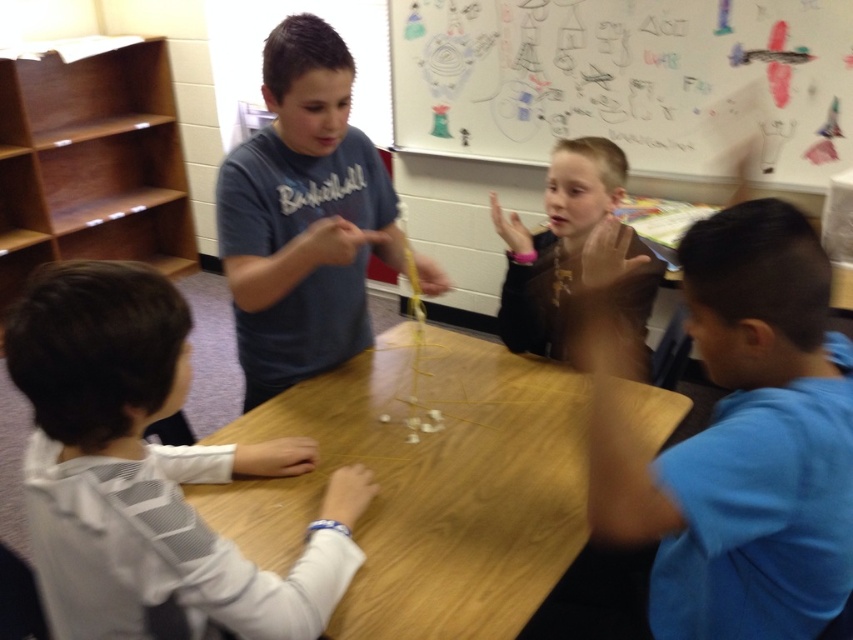
Question: Which of the following is the farthest from the observer?

Choices:
 (A) white mesh shirt at lower left
 (B) whiteboard at upper center

Answer: (B)

Question: Estimate the real-world distances between objects in this image. Which object is farther from the wooden table at center?

Choices:
 (A) dark brown leather jacket at center
 (B) whiteboard at upper center
 (C) white mesh shirt at lower left
 (D) matte gray shirt at center

Answer: (B)

Question: In this image, where is wooden table at center located relative to matte gray shirt at center?

Choices:
 (A) left
 (B) right

Answer: (B)

Question: Among these points, which one is farthest from the camera?

Choices:
 (A) (689, 88)
 (B) (315, 145)

Answer: (A)

Question: Is whiteboard at upper center closer to camera compared to dark brown leather jacket at center?

Choices:
 (A) yes
 (B) no

Answer: (B)

Question: In this image, where is blue cotton shirt at lower right located relative to dark brown leather jacket at center?

Choices:
 (A) above
 (B) below

Answer: (B)